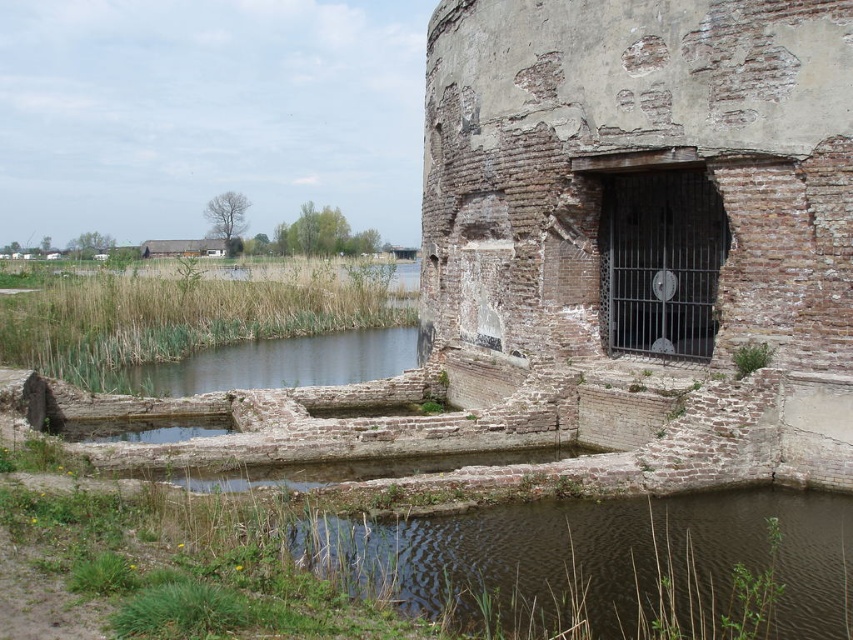
You are an architect analyzing the historical structure. Based on the coordinates provided, where is the weathered brick wall at center right located in the image?

The weathered brick wall at center right is located at the 2D coordinates point (650, 196).

You are standing in front of the historical structure and want to determine the position of two points marked on the image. Which point, point (817,125) or point (370,573), is closer to you?

Point (817,125) is further to the viewer than point (370,573), so the point closer to you is point (370,573).